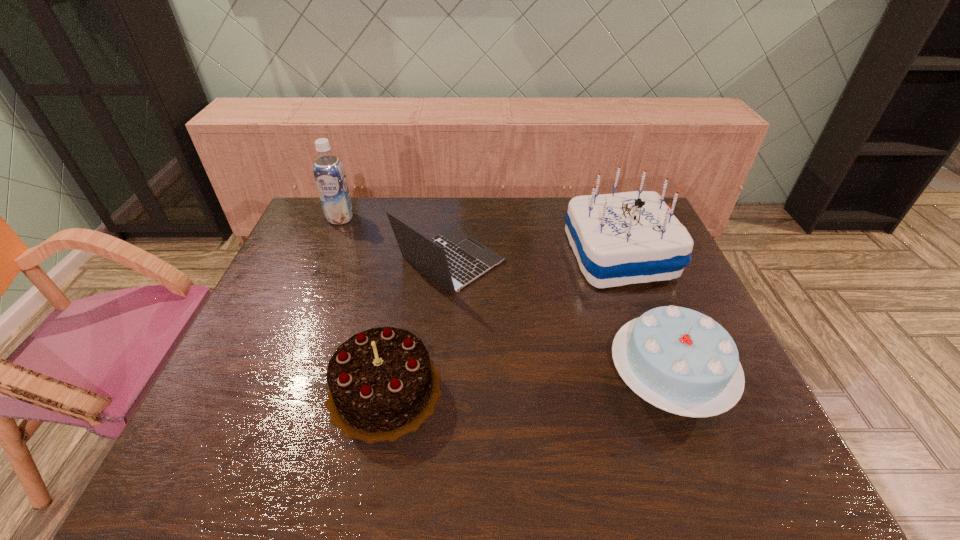
You are a GUI agent. You are given a task and a screenshot of the screen. Output one action in this format:
    pyautogui.click(x=<x>, y=<y>)
    Task: Click on the vacant space that is in between the tallest birthday cake and the leftmost object
    The image size is (960, 540).
    Given the screenshot: What is the action you would take?
    pyautogui.click(x=480, y=237)

At what (x,y) coordinates should I click in order to perform the action: click on free spot between the tallest birthday cake and the leftmost object. Please return your answer as a coordinate pair (x, y). Looking at the image, I should click on (480, 237).

You are a GUI agent. You are given a task and a screenshot of the screen. Output one action in this format:
    pyautogui.click(x=<x>, y=<y>)
    Task: Click on the free point between the tallest birthday cake and the soya milk
    This screenshot has height=540, width=960.
    Given the screenshot: What is the action you would take?
    pyautogui.click(x=480, y=237)

Find the location of `vacant area between the tallest birthday cake and the laptop_computer`. vacant area between the tallest birthday cake and the laptop_computer is located at coordinates (535, 258).

Locate an element on the screen. vacant area that lies between the tallest birthday cake and the leftmost birthday cake is located at coordinates (502, 322).

Select which object is the third closest to the laptop_computer. Please provide its 2D coordinates. Your answer should be formatted as a tuple, i.e. [(x, y)], where the tuple contains the x and y coordinates of a point satisfying the conditions above.

[(624, 238)]

Identify which object is the nearest to the laptop_computer. Please provide its 2D coordinates. Your answer should be formatted as a tuple, i.e. [(x, y)], where the tuple contains the x and y coordinates of a point satisfying the conditions above.

[(382, 384)]

Identify which birthday cake is the second nearest to the farthest birthday cake. Please provide its 2D coordinates. Your answer should be formatted as a tuple, i.e. [(x, y)], where the tuple contains the x and y coordinates of a point satisfying the conditions above.

[(382, 384)]

At what (x,y) coordinates should I click in order to perform the action: click on birthday cake that is the closest to the farthest birthday cake. Please return your answer as a coordinate pair (x, y). The width and height of the screenshot is (960, 540). Looking at the image, I should click on (679, 360).